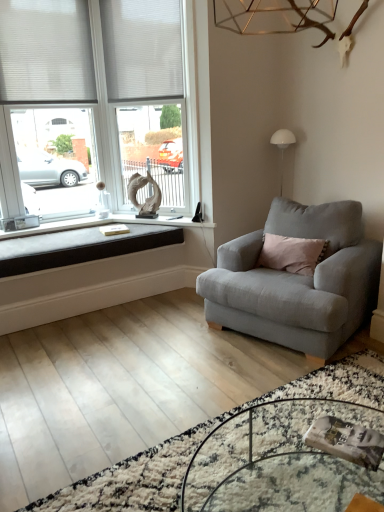
The height and width of the screenshot is (512, 384). Describe the element at coordinates (279, 461) in the screenshot. I see `clear glass table at lower center` at that location.

This screenshot has width=384, height=512. What are the coordinates of `white fabric blind at upper left, marked as the second blind in a right-to-left arrangement` in the screenshot? It's located at (46, 52).

What do you see at coordinates (149, 89) in the screenshot? The image size is (384, 512). I see `white plastic window frame at upper left` at bounding box center [149, 89].

The width and height of the screenshot is (384, 512). In order to click on clear glass table at lower center in this screenshot , I will do `click(279, 461)`.

How different are the orientations of white matte window at upper left and light gray fabric armchair at right in degrees?

The angular difference between white matte window at upper left and light gray fabric armchair at right is 70.9 degrees.

From the image's perspective, is white matte window at upper left under light gray fabric armchair at right?

No, from the image's perspective, white matte window at upper left is not beneath light gray fabric armchair at right.

From a real-world perspective, which is physically below, white matte window at upper left or light gray fabric armchair at right?

light gray fabric armchair at right.

Which object is further away from the camera taking this photo, white matte window at upper left or light gray fabric armchair at right?

Positioned behind is white matte window at upper left.

Is light gray fabric armchair at right in front of or behind white plastic window frame at upper left in the image?

Visually, light gray fabric armchair at right is located in front of white plastic window frame at upper left.

Is light gray fabric armchair at right facing away from white plastic window frame at upper left?

light gray fabric armchair at right does not have its back to white plastic window frame at upper left.

From the image's perspective, which is above, light gray fabric armchair at right or white plastic window frame at upper left?

white plastic window frame at upper left is shown above in the image.

Between light gray fabric armchair at right and white plastic window frame at upper left, which one has larger size?

Bigger between the two is light gray fabric armchair at right.

Is clear glass table at lower center outside of black fabric cushion at lower left?

Absolutely, clear glass table at lower center is external to black fabric cushion at lower left.

From a real-world perspective, which object stands above the other?

black fabric cushion at lower left.

Considering the positions of objects clear glass table at lower center and black fabric cushion at lower left in the image provided, who is more to the right, clear glass table at lower center or black fabric cushion at lower left?

Positioned to the right is clear glass table at lower center.

Is white fabric blind at upper left, the first blind when ordered from right to left, directly adjacent to white plastic window frame at upper left?

They are not placed beside each other.

Locate an element on the screen. This screenshot has width=384, height=512. blind that is behind the white plastic window frame at upper left is located at coordinates (142, 49).

Which object is further away from the camera taking this photo, white fabric blind at upper left, which is the 2th blind from left to right, or white plastic window frame at upper left?

white fabric blind at upper left, which is the 2th blind from left to right, is behind.

Is white fabric blind at upper left, which is the 2th blind from left to right, thinner than white plastic window frame at upper left?

Correct, the width of white fabric blind at upper left, which is the 2th blind from left to right, is less than that of white plastic window frame at upper left.

From a real-world perspective, relative to clear glass table at lower center, is white matte window at upper left vertically above or below?

In terms of real-world spatial position, white matte window at upper left is above clear glass table at lower center.

Is white matte window at upper left far away from clear glass table at lower center?

Yes, white matte window at upper left is far from clear glass table at lower center.

In the image, is white matte window at upper left on the left side or the right side of clear glass table at lower center?

white matte window at upper left is positioned on clear glass table at lower center's left side.

Looking at this image, which of these two, white matte window at upper left or clear glass table at lower center, is smaller?

With smaller size is clear glass table at lower center.

Could you tell me if clear glass table at lower center is turned towards white fabric blind at upper left, placed as the 1th blind when sorted from left to right?

No, clear glass table at lower center is not aimed at white fabric blind at upper left, placed as the 1th blind when sorted from left to right.

Which of these two, clear glass table at lower center or white fabric blind at upper left, marked as the second blind in a right-to-left arrangement, is wider?

With larger width is clear glass table at lower center.

Is clear glass table at lower center located outside white fabric blind at upper left, marked as the second blind in a right-to-left arrangement?

Yes, clear glass table at lower center is outside of white fabric blind at upper left, marked as the second blind in a right-to-left arrangement.

From a real-world perspective, does clear glass table at lower center sit lower than white fabric blind at upper left, marked as the second blind in a right-to-left arrangement?

Yes, from a real-world perspective, clear glass table at lower center is under white fabric blind at upper left, marked as the second blind in a right-to-left arrangement.

From a real-world perspective, relative to light gray fabric armchair at right, is white fabric blind at upper left, which is the 2th blind from left to right, vertically above or below?

Clearly, from a real-world perspective, white fabric blind at upper left, which is the 2th blind from left to right, is above light gray fabric armchair at right.

From the image's perspective, is white fabric blind at upper left, the first blind when ordered from right to left, below light gray fabric armchair at right?

No, from the image's perspective, white fabric blind at upper left, the first blind when ordered from right to left, is not beneath light gray fabric armchair at right.

The width and height of the screenshot is (384, 512). What are the coordinates of `blind that is the 2nd one above the light gray fabric armchair at right (from a real-world perspective)` in the screenshot? It's located at (142, 49).

Between white fabric blind at upper left, which is the 2th blind from left to right, and light gray fabric armchair at right, which one has less height?

With less height is light gray fabric armchair at right.

Locate an element on the screen. Image resolution: width=384 pixels, height=512 pixels. window located on the left of light gray fabric armchair at right is located at coordinates (99, 104).

There is a light gray fabric armchair at right. Where is `window frame above it (from a real-world perspective)`? The image size is (384, 512). window frame above it (from a real-world perspective) is located at coordinates (149, 89).

Consider the image. Which object lies further to the anchor point white plastic window frame at upper left, white fabric blind at upper left, marked as the second blind in a right-to-left arrangement, or white fabric blind at upper left, the first blind when ordered from right to left?

white fabric blind at upper left, marked as the second blind in a right-to-left arrangement, lies further to white plastic window frame at upper left than the other object.

When comparing their distances from white plastic window frame at upper left, does light gray fabric armchair at right or white fabric blind at upper left, placed as the 1th blind when sorted from left to right, seem further?

light gray fabric armchair at right is further to white plastic window frame at upper left.

From the image, which object appears to be farther from light gray fabric armchair at right, white matte window at upper left or clear glass table at lower center?

The object further to light gray fabric armchair at right is white matte window at upper left.

Estimate the real-world distances between objects in this image. Which object is closer to white fabric blind at upper left, marked as the second blind in a right-to-left arrangement, clear glass table at lower center or white fabric blind at upper left, the first blind when ordered from right to left?

The object closer to white fabric blind at upper left, marked as the second blind in a right-to-left arrangement, is white fabric blind at upper left, the first blind when ordered from right to left.

When comparing their distances from clear glass table at lower center, does black fabric cushion at lower left or white plastic window frame at upper left seem closer?

black fabric cushion at lower left lies closer to clear glass table at lower center than the other object.

When comparing their distances from light gray fabric armchair at right, does black fabric cushion at lower left or white fabric blind at upper left, marked as the second blind in a right-to-left arrangement, seem closer?

black fabric cushion at lower left is positioned closer to the anchor light gray fabric armchair at right.

When comparing their distances from white fabric blind at upper left, which is the 2th blind from left to right, does white fabric blind at upper left, placed as the 1th blind when sorted from left to right, or light gray fabric armchair at right seem further?

light gray fabric armchair at right.

Based on their spatial positions, is light gray fabric armchair at right or white fabric blind at upper left, which is the 2th blind from left to right, closer to white plastic window frame at upper left?

The object closer to white plastic window frame at upper left is white fabric blind at upper left, which is the 2th blind from left to right.

The height and width of the screenshot is (512, 384). In order to click on blind between white matte window at upper left and white fabric blind at upper left, which is the 2th blind from left to right, in the horizontal direction in this screenshot , I will do [x=46, y=52].

This screenshot has width=384, height=512. In order to click on window sill located between white fabric blind at upper left, placed as the 1th blind when sorted from left to right, and light gray fabric armchair at right in the left-right direction in this screenshot , I will do `click(80, 247)`.

Find the location of `window frame that lies between white fabric blind at upper left, marked as the second blind in a right-to-left arrangement, and black fabric cushion at lower left from top to bottom`. window frame that lies between white fabric blind at upper left, marked as the second blind in a right-to-left arrangement, and black fabric cushion at lower left from top to bottom is located at coordinates (149, 89).

Locate an element on the screen. This screenshot has width=384, height=512. blind between white fabric blind at upper left, which is the 2th blind from left to right, and clear glass table at lower center vertically is located at coordinates (46, 52).